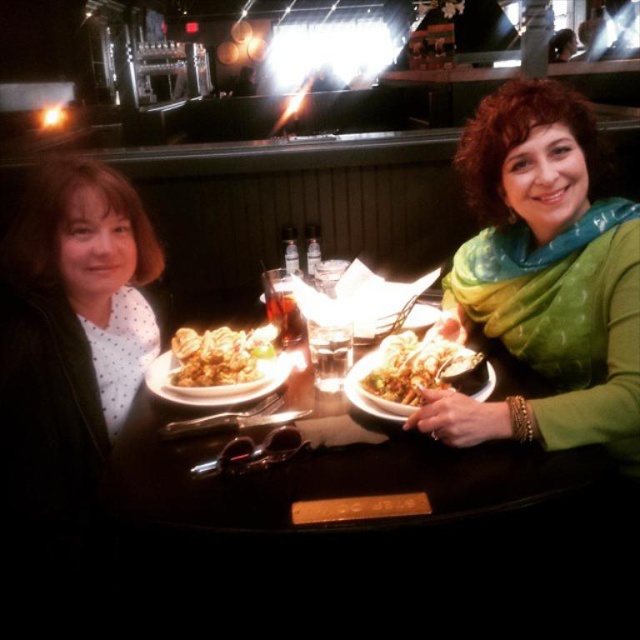
Is point (252, 332) positioned behind point (266, 392)?

Yes, point (252, 332) is behind point (266, 392).

Measure the distance between point (232, 333) and camera.

Point (232, 333) and camera are 1.33 meters apart from each other.

What do you see at coordinates (220, 355) in the screenshot? I see `golden crispy chicken at center` at bounding box center [220, 355].

Locate an element on the screen. golden crispy chicken at center is located at coordinates (220, 355).

Which is behind, point (528, 412) or point (179, 378)?

Positioned behind is point (179, 378).

This screenshot has height=640, width=640. Describe the element at coordinates (545, 276) in the screenshot. I see `green silk scarf at upper right` at that location.

Is point (538, 433) in front of point (252, 332)?

Yes, point (538, 433) is in front of point (252, 332).

In order to click on green silk scarf at upper right in this screenshot , I will do `click(545, 276)`.

Between point (401, 429) and point (378, 349), which one is positioned in front?

Positioned in front is point (401, 429).

Who is lower down, wooden table at center or golden crispy noodles at center?

wooden table at center

Which is behind, point (394, 468) or point (433, 365)?

The point (433, 365) is behind.

Find the location of a particular element. wooden table at center is located at coordinates (321, 474).